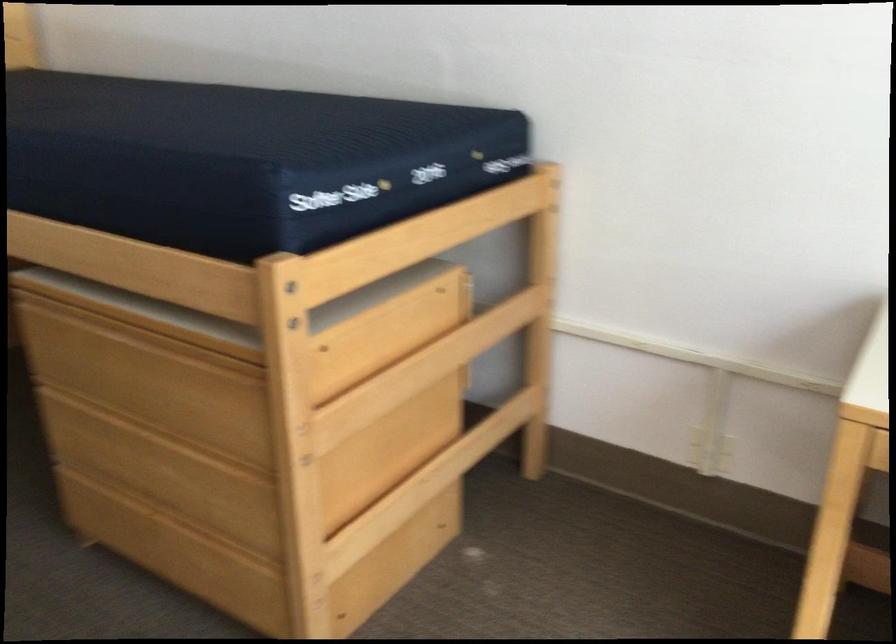
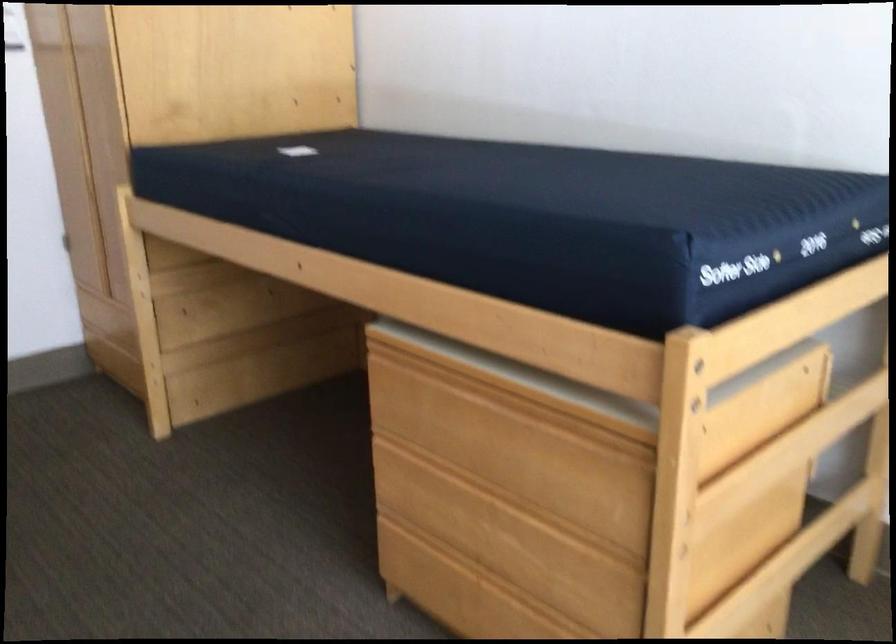
Question: The images are taken continuously from a first-person perspective. In which direction are you moving?

Choices:
 (A) Left
 (B) Right
 (C) Forward
 (D) Backward

Answer: (A)